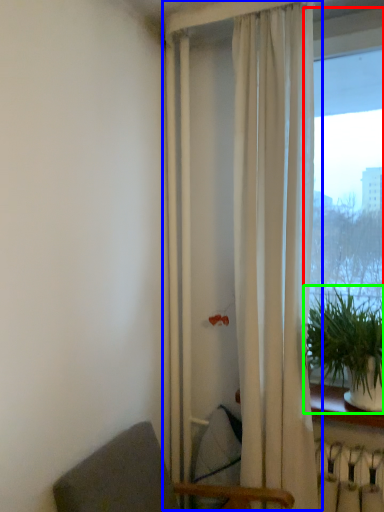
Question: Which is nearer to the window (highlighted by a red box)? curtain (highlighted by a blue box) or houseplant (highlighted by a green box).

Choices:
 (A) curtain
 (B) houseplant

Answer: (A)